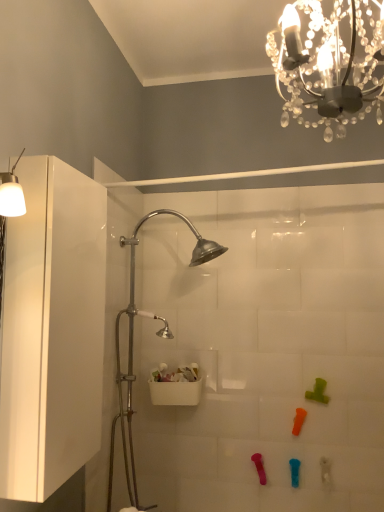
Question: In which direction should I rotate to look at pink rubber toy at lower center, the 1th toy when ordered from left to right?

Choices:
 (A) right
 (B) left

Answer: (A)

Question: From the image's perspective, is blue rubber toy at lower center, the second toy when ordered from left to right, located above orange rubber toy at lower center, the third toy positioned from the right?

Choices:
 (A) no
 (B) yes

Answer: (A)

Question: Can you see blue rubber toy at lower center, which is counted as the 4th toy, starting from the right, touching orange rubber toy at lower center, the third toy viewed from the left?

Choices:
 (A) yes
 (B) no

Answer: (B)

Question: Does blue rubber toy at lower center, the second toy when ordered from left to right, have a lesser height compared to orange rubber toy at lower center, the third toy positioned from the right?

Choices:
 (A) yes
 (B) no

Answer: (A)

Question: Is orange rubber toy at lower center, the third toy viewed from the left, at the back of blue rubber toy at lower center, which is counted as the 4th toy, starting from the right?

Choices:
 (A) no
 (B) yes

Answer: (A)

Question: From a real-world perspective, is blue rubber toy at lower center, the second toy when ordered from left to right, positioned over orange rubber toy at lower center, the third toy positioned from the right, based on gravity?

Choices:
 (A) yes
 (B) no

Answer: (B)

Question: Does blue rubber toy at lower center, the second toy when ordered from left to right, have a larger size compared to orange rubber toy at lower center, the third toy viewed from the left?

Choices:
 (A) no
 (B) yes

Answer: (A)

Question: Considering the relative sizes of white glossy cabinet at left and clear crystal chandelier at upper center in the image provided, is white glossy cabinet at left thinner than clear crystal chandelier at upper center?

Choices:
 (A) no
 (B) yes

Answer: (B)

Question: Is white glossy cabinet at left further to camera compared to clear crystal chandelier at upper center?

Choices:
 (A) no
 (B) yes

Answer: (B)

Question: Does white glossy cabinet at left have a lesser height compared to clear crystal chandelier at upper center?

Choices:
 (A) yes
 (B) no

Answer: (B)

Question: From a real-world perspective, is white glossy cabinet at left located beneath clear crystal chandelier at upper center?

Choices:
 (A) yes
 (B) no

Answer: (A)

Question: From the image's perspective, does white glossy cabinet at left appear higher than clear crystal chandelier at upper center?

Choices:
 (A) yes
 (B) no

Answer: (B)

Question: Does white glossy cabinet at left appear on the right side of clear crystal chandelier at upper center?

Choices:
 (A) no
 (B) yes

Answer: (A)

Question: Can you confirm if translucent plastic toy at lower right, arranged as the 1th toy when viewed from the right, is shorter than white plastic shower door at center?

Choices:
 (A) yes
 (B) no

Answer: (A)